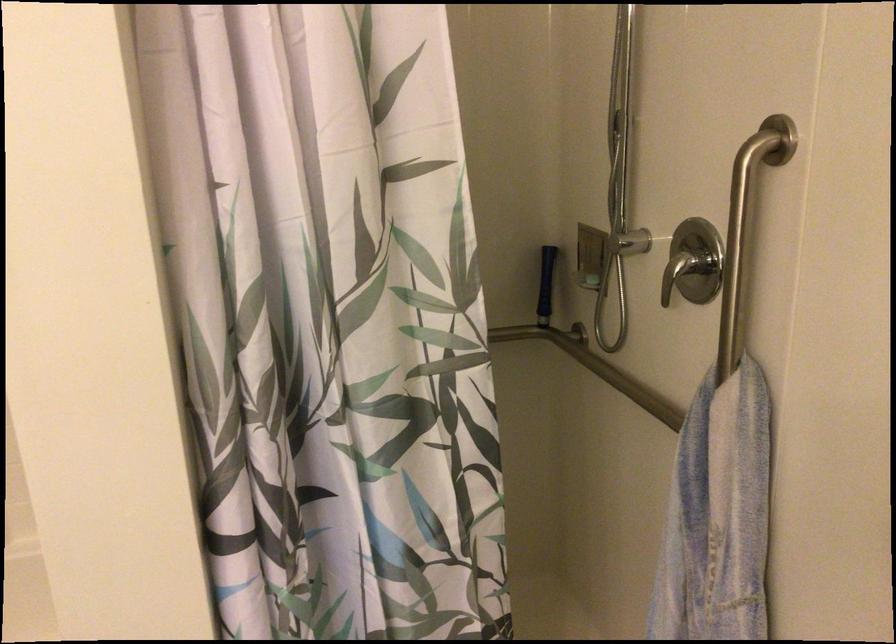
What do you see at coordinates (616, 377) in the screenshot?
I see `a horizontal grab bar` at bounding box center [616, 377].